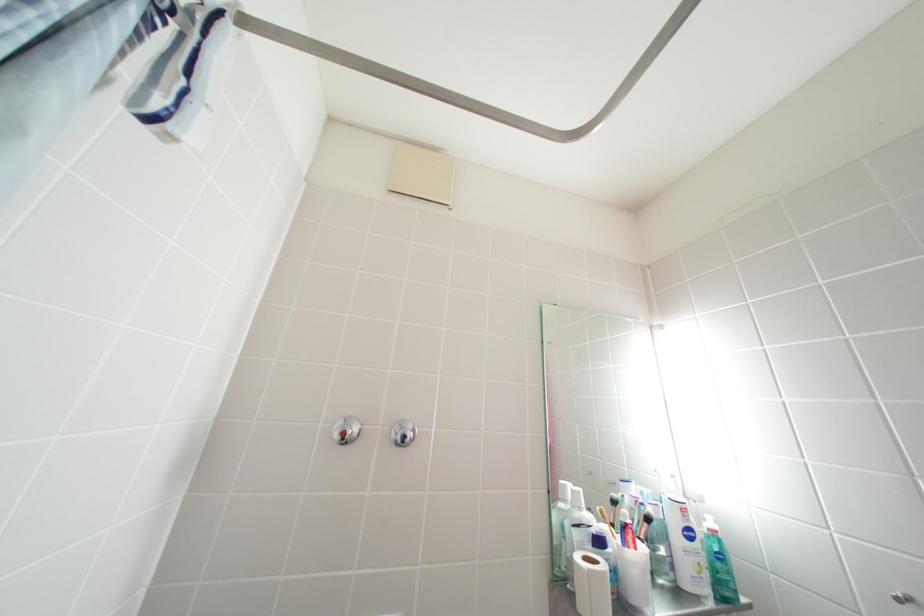
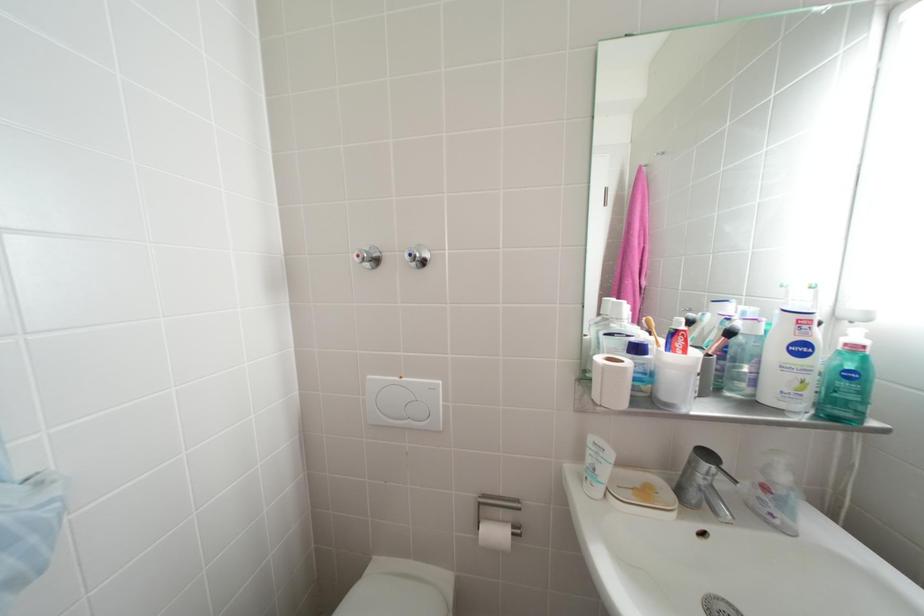
First-person continuous shooting, in which direction is the camera rotating?

The camera's rotation is toward left-down.